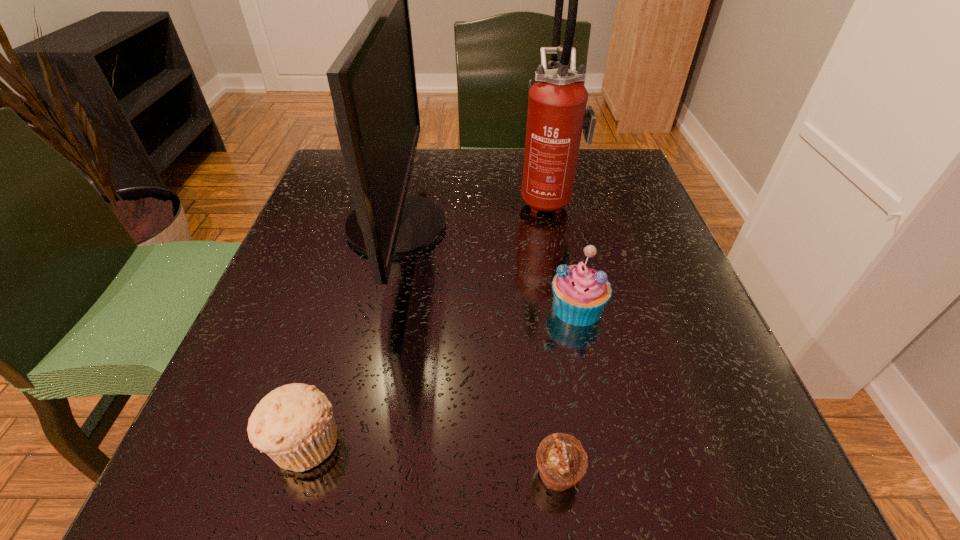
Where is `free space between the fire extinguisher and the monitor`? The image size is (960, 540). free space between the fire extinguisher and the monitor is located at coordinates (472, 212).

Locate an element on the screen. free space between the monitor and the farthest muffin is located at coordinates (487, 267).

Where is `empty space that is in between the farthest muffin and the fire extinguisher`? empty space that is in between the farthest muffin and the fire extinguisher is located at coordinates (563, 253).

Identify which object is the second closest to the monitor. Please provide its 2D coordinates. Your answer should be formatted as a tuple, i.e. [(x, y)], where the tuple contains the x and y coordinates of a point satisfying the conditions above.

[(557, 113)]

Locate an element on the screen. The image size is (960, 540). object that is the nearest to the leftmost muffin is located at coordinates (372, 81).

In order to click on the second closest muffin to the fire extinguisher in this screenshot , I will do `click(561, 460)`.

Locate which muffin is the third closest to the monitor. Please provide its 2D coordinates. Your answer should be formatted as a tuple, i.e. [(x, y)], where the tuple contains the x and y coordinates of a point satisfying the conditions above.

[(561, 460)]

Where is `vacant area that satisfies the following two spatial constraints: 1. on the back side of the farthest muffin; 2. on the screen side of the monitor`? This screenshot has height=540, width=960. vacant area that satisfies the following two spatial constraints: 1. on the back side of the farthest muffin; 2. on the screen side of the monitor is located at coordinates [x=560, y=226].

Identify the location of free point that satisfies the following two spatial constraints: 1. at the nozzle of the fire extinguisher; 2. on the back side of the farthest muffin. This screenshot has height=540, width=960. tap(569, 307).

The image size is (960, 540). I want to click on blank space that satisfies the following two spatial constraints: 1. at the nozzle of the fire extinguisher; 2. on the back side of the farthest muffin, so click(x=569, y=307).